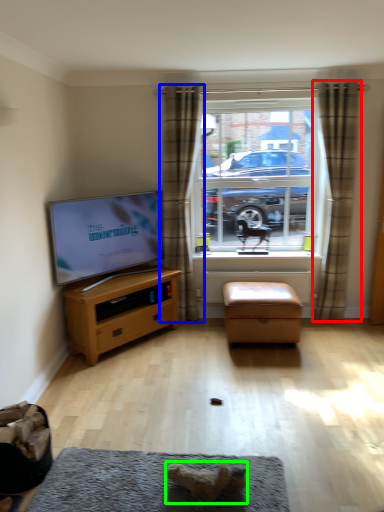
Question: Which object is positioned farthest from curtain (highlighted by a red box)? Select from curtain (highlighted by a blue box) and animal (highlighted by a green box).

Choices:
 (A) curtain
 (B) animal

Answer: (B)